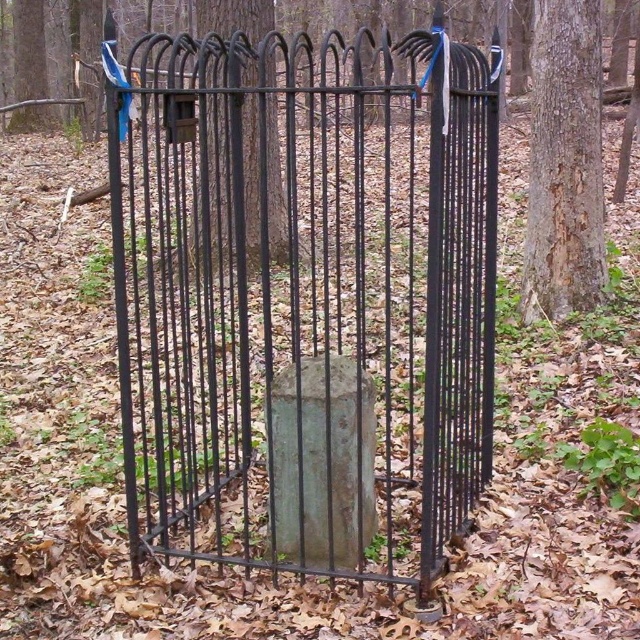
You are a painter carrying a 1.8 meter long ladder. You need to place the ladder between the smooth brown bark at right and the black metal fence at center. Can you fit the ladder horizontally between them without bending it?

The distance between the smooth brown bark at right and the black metal fence at center is 2.03 meters. Since the ladder is 1.8 meters long, it can fit horizontally between them as the space is wider than the ladder.

You are standing in front of a black metal gate in a wooded area. You notice two gates labeled as black wrought iron gate at center and matte black gate at center. According to their positions, which one is closer to your right side?

The black wrought iron gate at center is to the right of matte black gate at center, so the black wrought iron gate at center is closer to your right side.

You are a hiker who wants to take a photo of the black metal fence at center without any obstruction. Since you can only move sideways, can you move to the right of the smooth brown bark at right to capture the fence clearly?

The black metal fence at center is behind the smooth brown bark at right, so moving to the right of the smooth brown bark at right would still have the bark blocking the view of the fence. You need to move to the left side of the smooth brown bark at right to see the fence without obstruction.